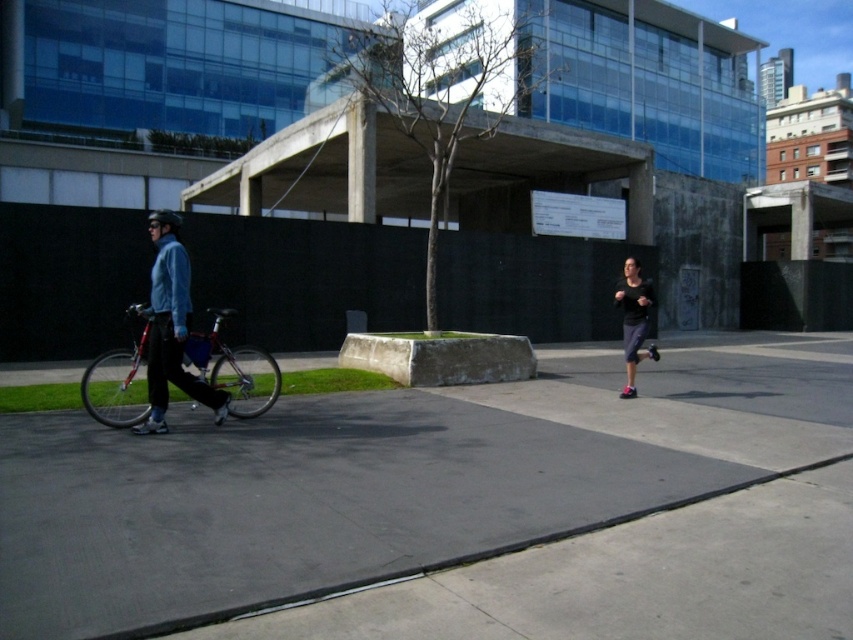
You are a pedestrian trying to cross the gray concrete pavement at center. There is a runner wearing black matte running shoes at right. Where should you look to avoid the runner?

The gray concrete pavement at center is below the black matte running shoes at right, so the runner is on the gray concrete pavement at center. To avoid them, look towards the edges of the gray concrete pavement at center where there might be a safer path.

You are standing at the origin point in the urban outdoor scene. There are two points marked on the ground, one at coordinates point (271,394) and another at point (169,337). Which point is farther away from you?

Point (271,394) is behind point (169,337), so it is farther away from you.

You are a delivery person who needs to park your shiny metallic bicycle at left in a designated parking area. The parking area is located at coordinates point 0.6, 0.3. Is the bicycle already parked in the correct spot?

The shiny metallic bicycle at left is at point (234,369), which is close to the parking area at (254,384) but not exactly at the designated coordinates. Therefore, it is not parked correctly.